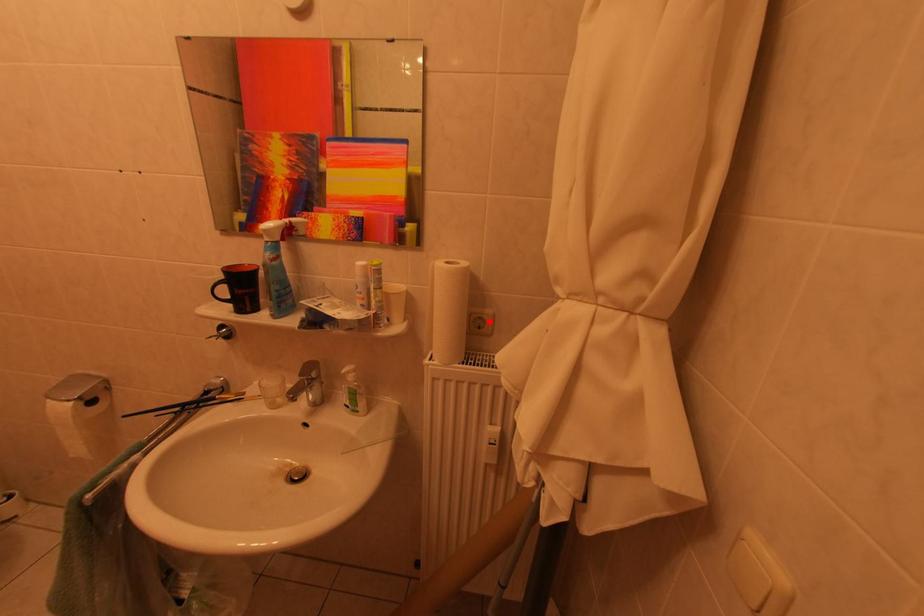
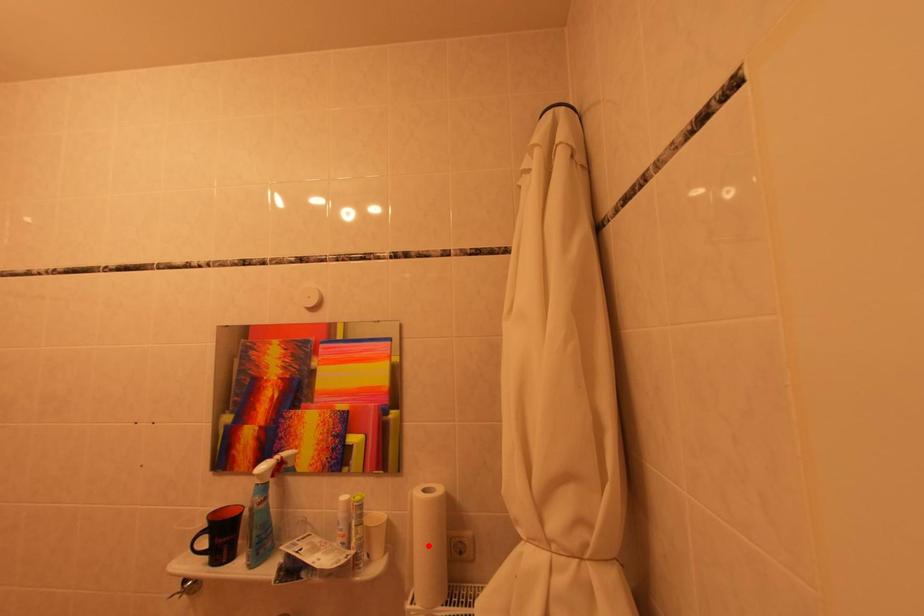
I am providing you with two images of the same scene from different viewpoints. A red point is marked on the first image and another point is marked on the second image. Is the red point in image1 aligned with the point shown in image2?

No